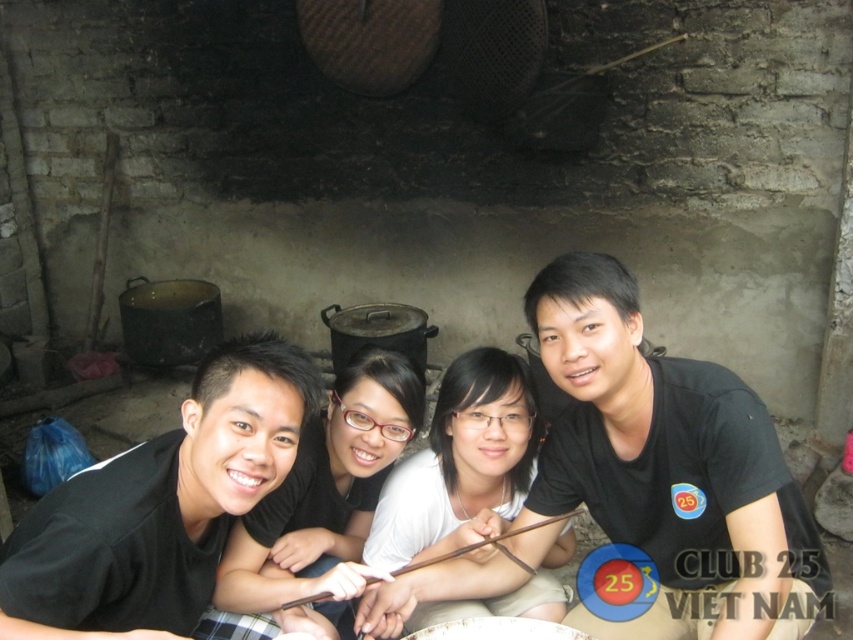
Looking at this image, you are standing in the rustic kitchen scene and want to find the black matte shirt at center. According to the coordinates provided, where exactly should you look to locate it?

The black matte shirt at center is located at coordinates point (668,467).

You are a photographer trying to adjust the composition of the group photo in the rustic kitchen. You notice two black matte shirts among the subjects. Which one, the black matte shirt at center or the black matte shirt at left, appears taller in the photo?

The black matte shirt at center appears taller than the black matte shirt at left in the photo.

You are a photographer standing in the rustic kitchen scene. You need to adjust the camera focus so that both the black matte shirt at center and the black matte shirt at left are in sharp focus. Given that the camera can only focus on objects within a 20 inch range, will both shirts be in focus?

The black matte shirt at center is 23.52 inches away from the black matte shirt at left, which exceeds the camera focus range of 20 inches. Therefore, both shirts cannot be in focus simultaneously.